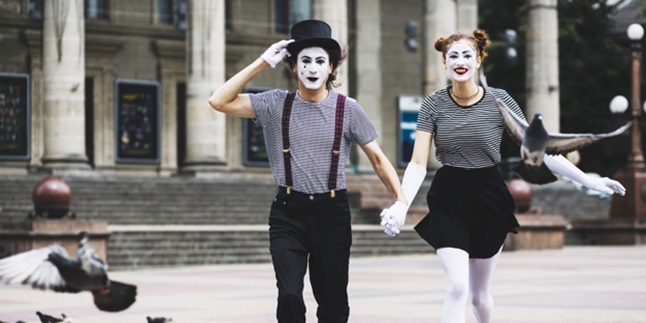
I want to click on door, so click(126, 151).